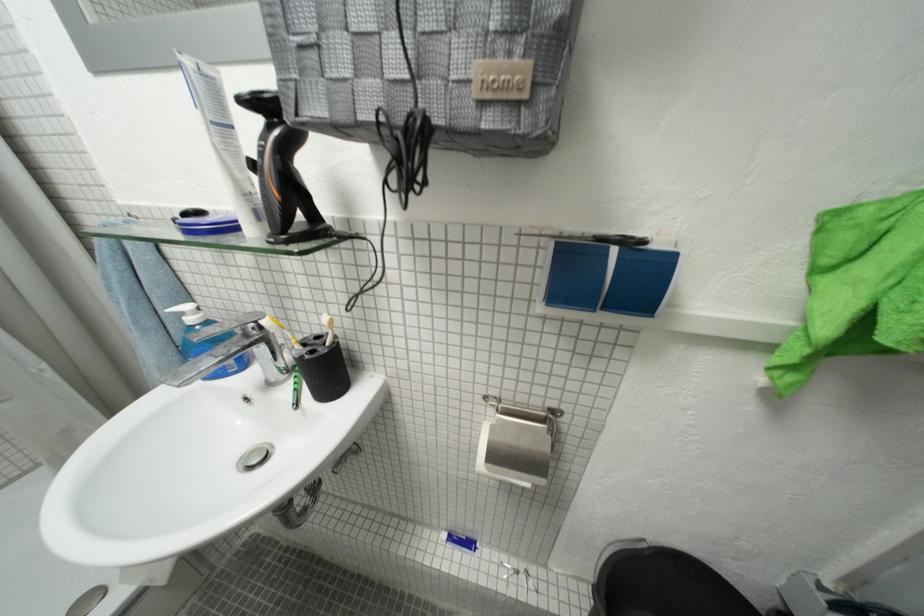
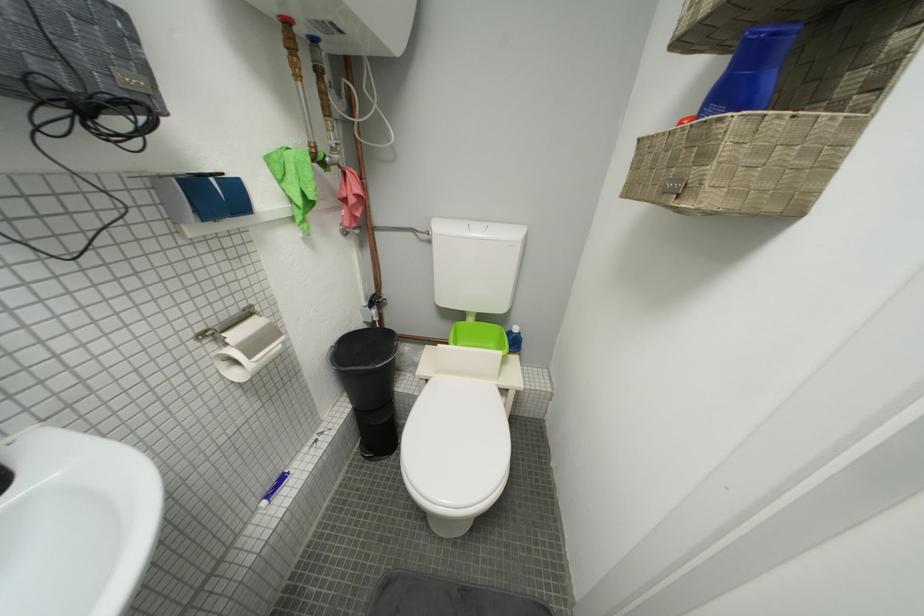
The first image is from the beginning of the video and the second image is from the end. How did the camera likely rotate when shooting the video?

The camera rotated toward right-down.